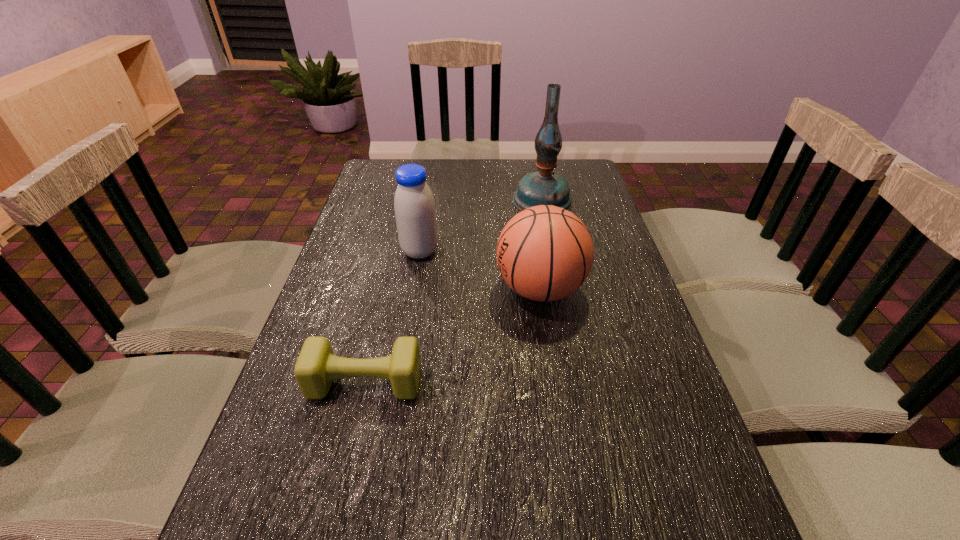
The width and height of the screenshot is (960, 540). What are the coordinates of `free spot between the dumbbell and the soya milk` in the screenshot? It's located at (393, 317).

Find the location of a particular element. free space between the dumbbell and the oil lamp is located at coordinates (454, 291).

Find the location of `free space between the nearest object and the soya milk`. free space between the nearest object and the soya milk is located at coordinates (393, 317).

Find the location of a particular element. unoccupied area between the basketball and the soya milk is located at coordinates (480, 270).

Locate which object ranks third in proximity to the tallest object. Please provide its 2D coordinates. Your answer should be formatted as a tuple, i.e. [(x, y)], where the tuple contains the x and y coordinates of a point satisfying the conditions above.

[(316, 367)]

This screenshot has height=540, width=960. I want to click on object identified as the second closest to the farthest object, so [x=414, y=205].

Where is `vacant space that satisfies the following two spatial constraints: 1. on the back side of the soya milk; 2. on the right side of the tallest object`? vacant space that satisfies the following two spatial constraints: 1. on the back side of the soya milk; 2. on the right side of the tallest object is located at coordinates (428, 200).